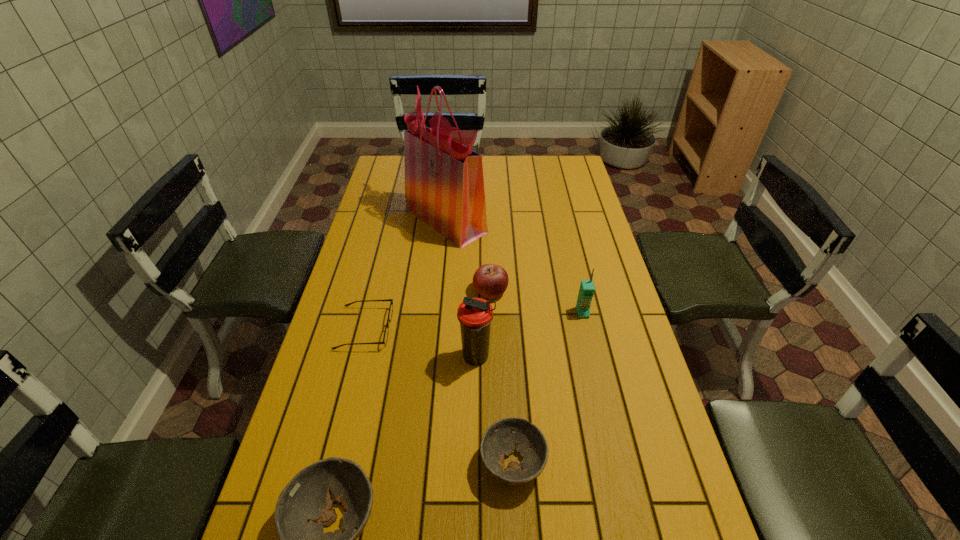
In the current image, all bowls are evenly spaced. To maintain this equal spacing, where should an additional bowl be placed on the right? Please point out a free spot. Please provide its 2D coordinates. Your answer should be formatted as a tuple, i.e. [(x, y)], where the tuple contains the x and y coordinates of a point satisfying the conditions above.

[(662, 415)]